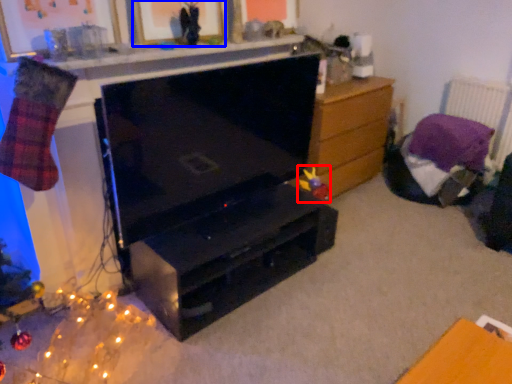
Question: Which object appears closest to the camera in this image, toy (highlighted by a red box) or picture frame (highlighted by a blue box)?

Choices:
 (A) toy
 (B) picture frame

Answer: (B)